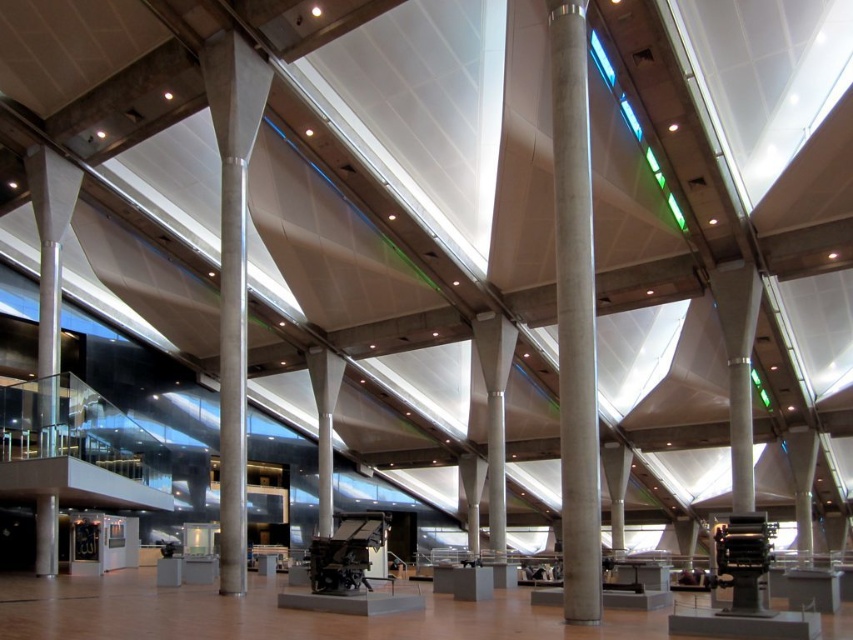
You are a delivery person carrying a large, heavy crate that needs to be moved through the space between the concrete column at center and the concrete at center. Based on the scene description, can you determine if the space between them is wide enough for your crate?

The concrete column at center is thinner than the concrete at center, so the space between them is wider than the column itself. However, without knowing the exact width of the crate or the distance between the two objects, it is impossible to determine if the space is sufficient. Please provide more details about the crate or the distance between the objects.

You are a visitor in the museum and want to take a photo of the concrete column at center and the concrete at center. Which one should you focus on first if you want to capture both in one shot without moving the camera?

You should focus on the concrete column at center first because it is positioned on the right side of the concrete at center, so it will be closer to the camera and easier to capture in the frame.